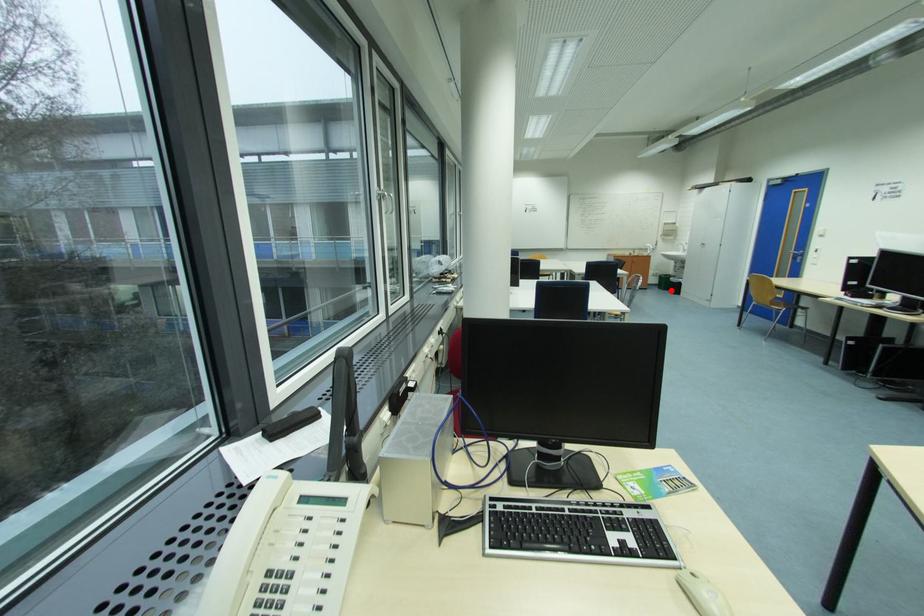
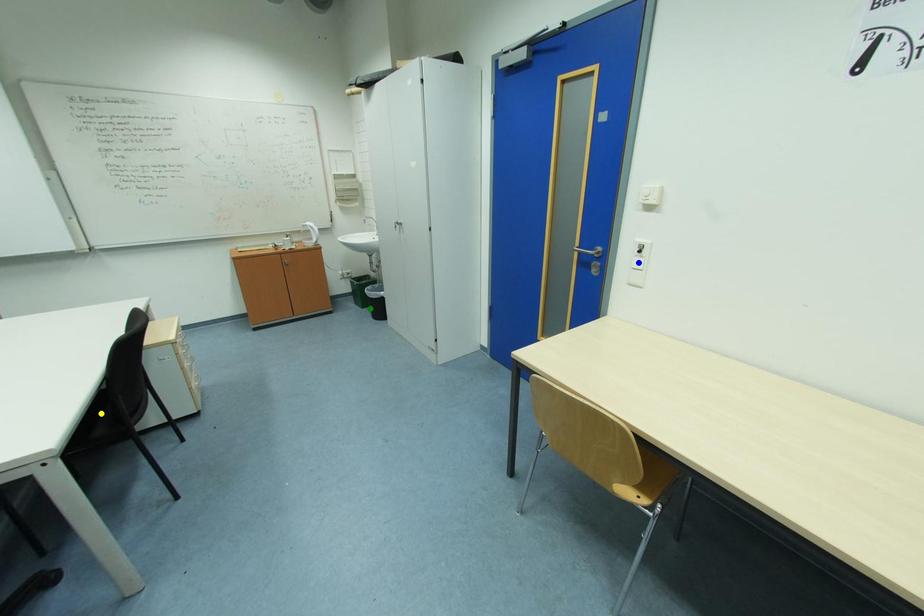
Question: I am providing you with two images of the same scene from different viewpoints. A red point is marked on the first image. You are given multiple points on the second image. Can you choose the point in image 2 that corresponds to the point in image 1?

Choices:
 (A) blue point
 (B) green point
 (C) yellow point

Answer: (B)